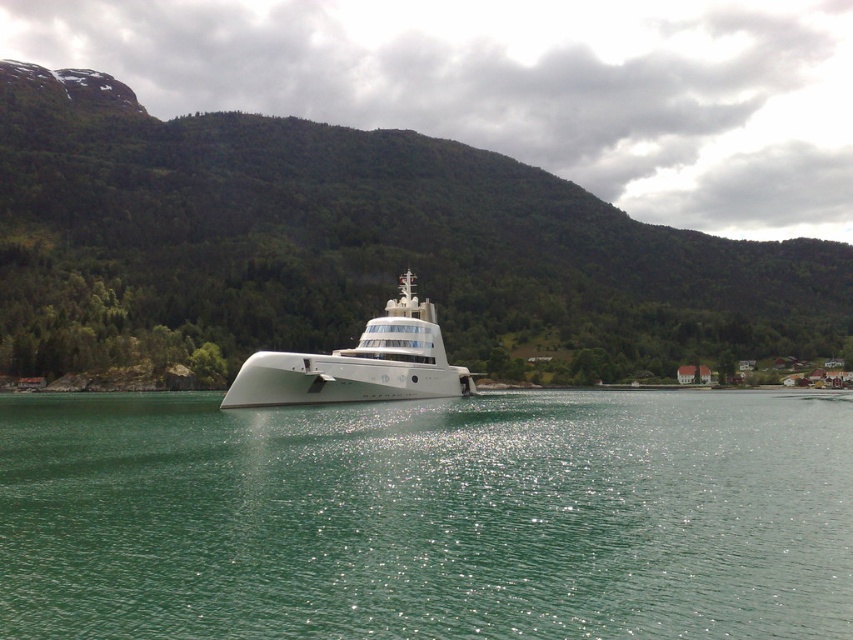
Question: Which point is farther to the camera?

Choices:
 (A) (753, 566)
 (B) (322, 358)

Answer: (B)

Question: Considering the relative positions of green glossy water at center and white glossy cruise ship at center in the image provided, where is green glossy water at center located with respect to white glossy cruise ship at center?

Choices:
 (A) left
 (B) right

Answer: (B)

Question: Does green glossy water at center appear over white glossy cruise ship at center?

Choices:
 (A) yes
 (B) no

Answer: (B)

Question: Which point is closer to the camera?

Choices:
 (A) white glossy cruise ship at center
 (B) green glossy water at center

Answer: (B)

Question: Does green glossy water at center come in front of white glossy cruise ship at center?

Choices:
 (A) yes
 (B) no

Answer: (A)